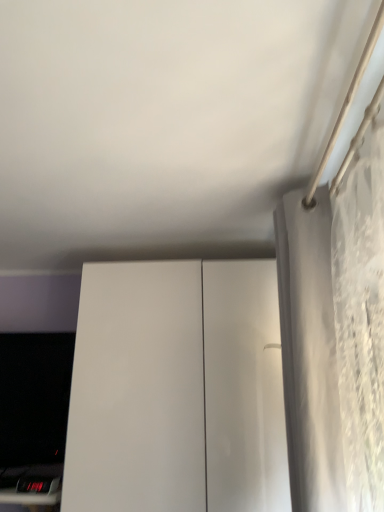
Question: Is white textured curtain at right oriented towards black glossy computer monitor at lower left?

Choices:
 (A) no
 (B) yes

Answer: (A)

Question: From a real-world perspective, is white textured curtain at right positioned under black glossy computer monitor at lower left based on gravity?

Choices:
 (A) no
 (B) yes

Answer: (A)

Question: Considering the relative sizes of white textured curtain at right and black glossy computer monitor at lower left in the image provided, is white textured curtain at right bigger than black glossy computer monitor at lower left?

Choices:
 (A) no
 (B) yes

Answer: (B)

Question: Does white textured curtain at right come behind black glossy computer monitor at lower left?

Choices:
 (A) no
 (B) yes

Answer: (A)

Question: Is white textured curtain at right next to black glossy computer monitor at lower left and touching it?

Choices:
 (A) yes
 (B) no

Answer: (B)

Question: Is white textured curtain at right completely or partially outside of black glossy computer monitor at lower left?

Choices:
 (A) yes
 (B) no

Answer: (A)

Question: Is white glossy cabinet at center at the back of white textured curtain at right?

Choices:
 (A) yes
 (B) no

Answer: (B)

Question: Are white textured curtain at right and white glossy cabinet at center beside each other?

Choices:
 (A) no
 (B) yes

Answer: (A)

Question: From the image's perspective, does white textured curtain at right appear lower than white glossy cabinet at center?

Choices:
 (A) no
 (B) yes

Answer: (A)

Question: Is white textured curtain at right outside of white glossy cabinet at center?

Choices:
 (A) yes
 (B) no

Answer: (A)

Question: From the image's perspective, is white textured curtain at right located above white glossy cabinet at center?

Choices:
 (A) yes
 (B) no

Answer: (A)

Question: Does white textured curtain at right have a greater height compared to white glossy cabinet at center?

Choices:
 (A) no
 (B) yes

Answer: (A)

Question: Is black glossy computer monitor at lower left not close to white glossy cabinet at center?

Choices:
 (A) yes
 (B) no

Answer: (B)